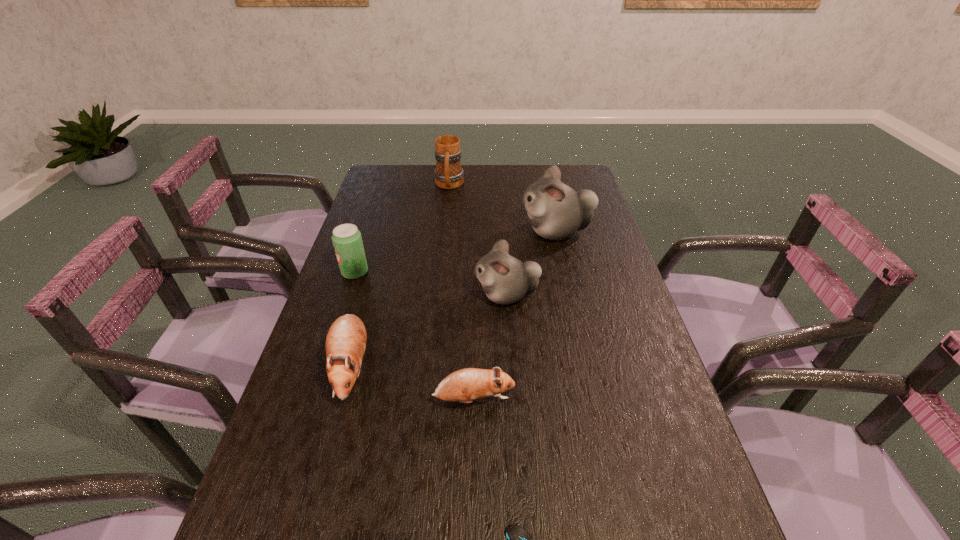
The height and width of the screenshot is (540, 960). What are the coordinates of `the tallest object` in the screenshot? It's located at (556, 211).

Locate an element on the screen. the farther white hamster is located at coordinates (556, 211).

Where is `the farthest object`? the farthest object is located at coordinates (448, 174).

This screenshot has height=540, width=960. In order to click on the second farthest hamster in this screenshot , I will do `click(505, 279)`.

I want to click on the second tallest hamster, so click(x=505, y=279).

Identify the location of soda. (347, 240).

Identify the location of the bigger brown hamster. The height and width of the screenshot is (540, 960). (345, 345).

Where is `the leftmost hamster`? Image resolution: width=960 pixels, height=540 pixels. the leftmost hamster is located at coordinates (345, 345).

Locate an element on the screen. The width and height of the screenshot is (960, 540). the shortest hamster is located at coordinates (465, 385).

You are a GUI agent. You are given a task and a screenshot of the screen. Output one action in this format:
    pyautogui.click(x=<x>, y=<y>)
    Task: Click on the right brown hamster
    This screenshot has height=540, width=960.
    Given the screenshot: What is the action you would take?
    pyautogui.click(x=465, y=385)